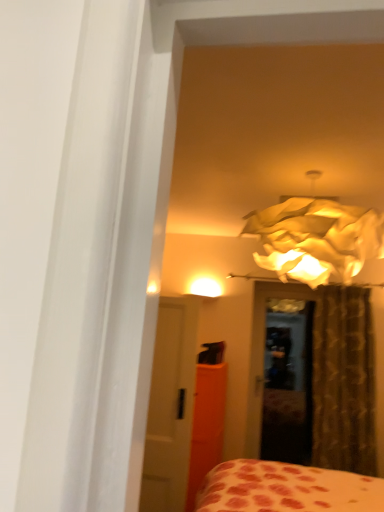
Question: Should I look upward or downward to see matte paper lampshade at upper center?

Choices:
 (A) down
 (B) up

Answer: (B)

Question: From the image's perspective, is white glossy door at center on top of orange matte armoire at center?

Choices:
 (A) yes
 (B) no

Answer: (A)

Question: Does white glossy door at center have a greater height compared to orange matte armoire at center?

Choices:
 (A) yes
 (B) no

Answer: (A)

Question: Considering the relative positions of white glossy door at center and orange matte armoire at center in the image provided, is white glossy door at center behind orange matte armoire at center?

Choices:
 (A) no
 (B) yes

Answer: (A)

Question: Is orange matte armoire at center completely or partially inside white glossy door at center?

Choices:
 (A) no
 (B) yes

Answer: (A)

Question: Considering the relative sizes of white glossy door at center and orange matte armoire at center in the image provided, is white glossy door at center smaller than orange matte armoire at center?

Choices:
 (A) yes
 (B) no

Answer: (A)

Question: Is white glossy door at center not inside orange matte armoire at center?

Choices:
 (A) yes
 (B) no

Answer: (A)

Question: From a real-world perspective, is white glossy door at center physically above matte paper lampshade at upper center?

Choices:
 (A) no
 (B) yes

Answer: (A)

Question: From the image's perspective, is white glossy door at center on matte paper lampshade at upper center?

Choices:
 (A) yes
 (B) no

Answer: (B)

Question: Would you say white glossy door at center is outside matte paper lampshade at upper center?

Choices:
 (A) no
 (B) yes

Answer: (B)

Question: From the image's perspective, is white glossy door at center below matte paper lampshade at upper center?

Choices:
 (A) yes
 (B) no

Answer: (A)

Question: Is white glossy door at center placed right next to matte paper lampshade at upper center?

Choices:
 (A) no
 (B) yes

Answer: (A)

Question: Is white glossy door at center positioned far away from matte paper lampshade at upper center?

Choices:
 (A) yes
 (B) no

Answer: (A)

Question: Does matte paper lampshade at upper center have a greater height compared to brown textured curtain at right?

Choices:
 (A) no
 (B) yes

Answer: (A)